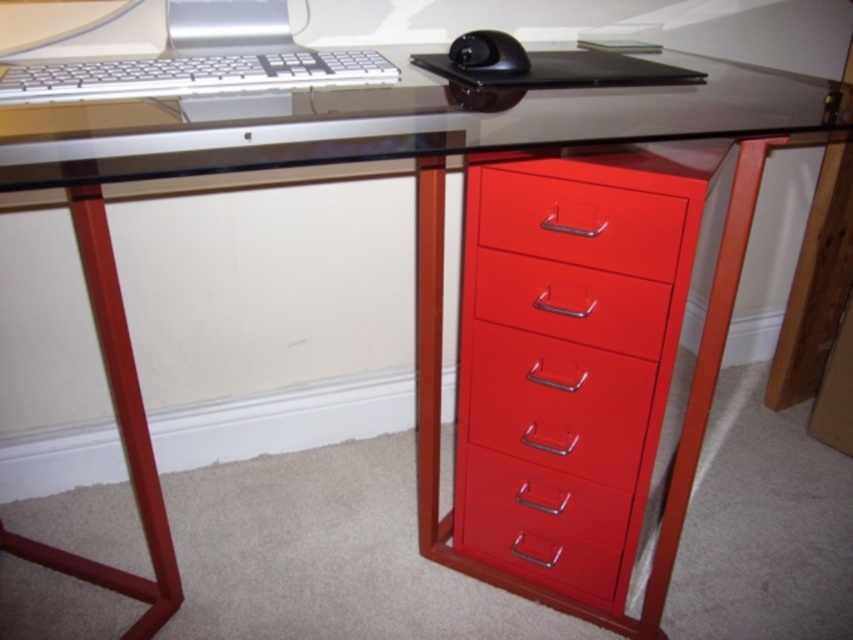
You are organizing your desk and want to place a new item between the silver metallic desktop computer at upper center and the black glossy mouse at upper center. Considering their sizes, which item should you place closer to the edge of the desk to ensure enough space for both?

Since the silver metallic desktop computer at upper center is larger than the black glossy mouse at upper center, you should place the black glossy mouse at upper center closer to the edge of the desk to accommodate the larger computer.

You are sitting at the desk and want to reach both the point at coordinates (544, 195) and the point at coordinates (294, 83). Which point is closer to you?

Point (544, 195) is closer to you because it is further to the viewer than point (294, 83).

You are a delivery person trying to place a package on the desk. The package is 80 centimeters long. Can you fit the package horizontally on the desk without it hanging off the edge? Please consider the distance from the camera to the glossy red drawer at right and the desk dimensions.

The glossy red drawer at right is 84.45 centimeters from the camera. Since the package is 80 centimeters long, it can fit horizontally on the desk as the distance from the camera to the drawer is longer than the package length, indicating sufficient desk space.